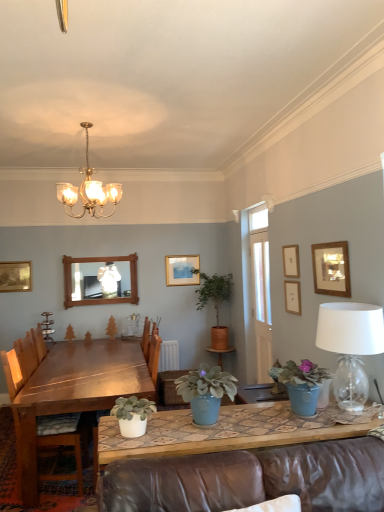
Locate an element on the screen. This screenshot has height=512, width=384. vacant area on top of gold metallic chandelier at upper center (from a real-world perspective) is located at coordinates (92, 119).